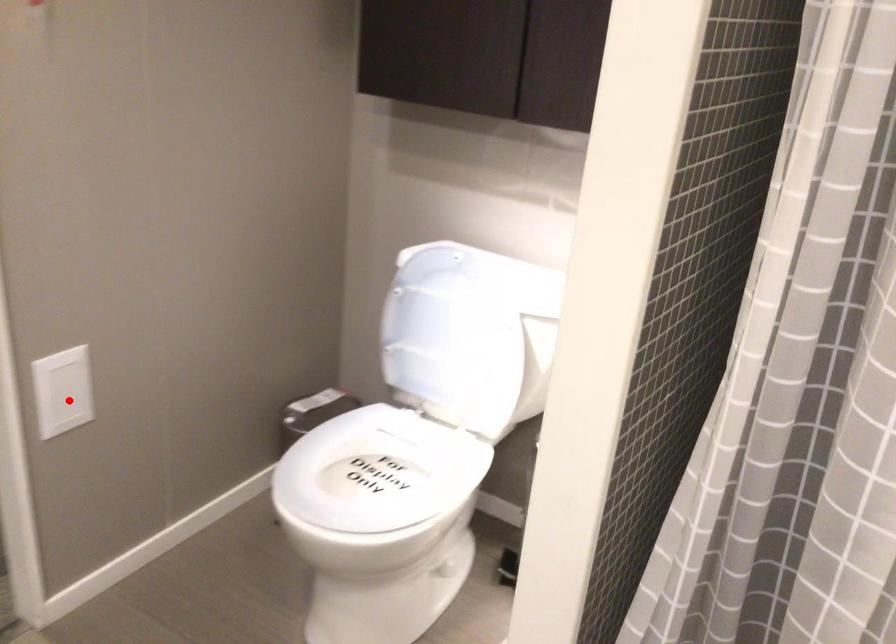
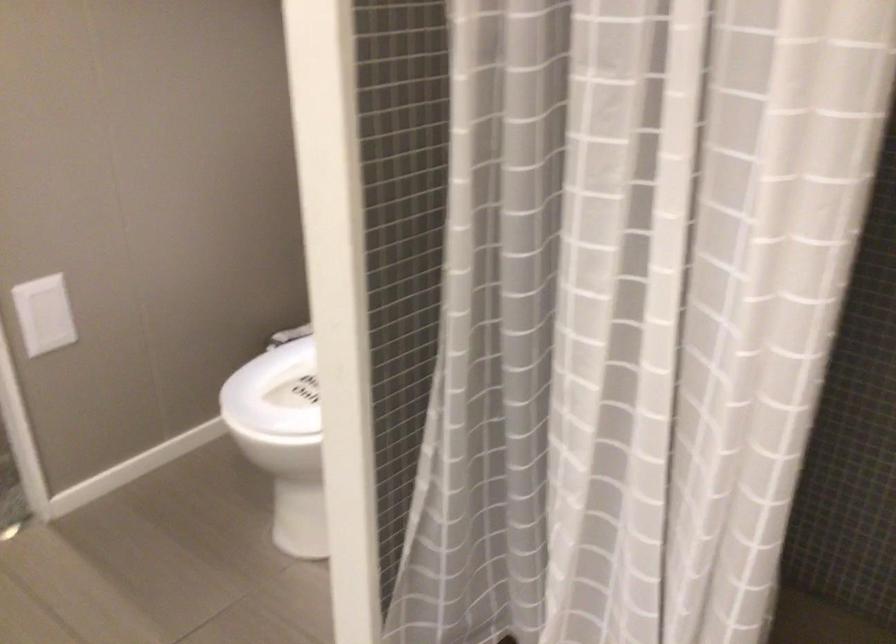
Question: I am providing you with two images of the same scene from different viewpoints. A red point is shown in image1. For the corresponding object point in image2, is it positioned nearer or farther from the camera?

Choices:
 (A) Nearer
 (B) Farther

Answer: (B)